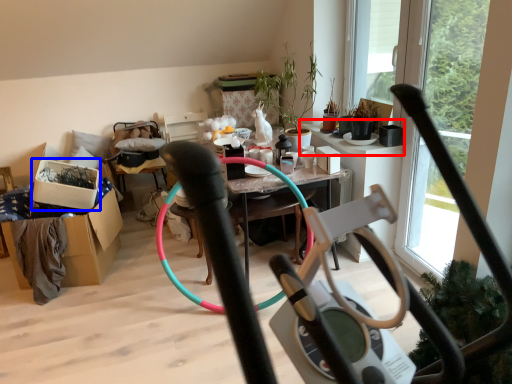
Question: Which of the following is the farthest to the observer, window sill (highlighted by a red box) or box (highlighted by a blue box)?

Choices:
 (A) window sill
 (B) box

Answer: (A)